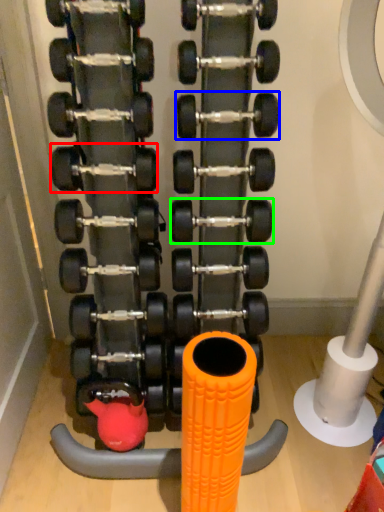
Question: Estimate the real-world distances between objects in this image. Which object is closer to dumbbell (highlighted by a red box), dumbbell (highlighted by a blue box) or dumbbell (highlighted by a green box)?

Choices:
 (A) dumbbell
 (B) dumbbell

Answer: (A)